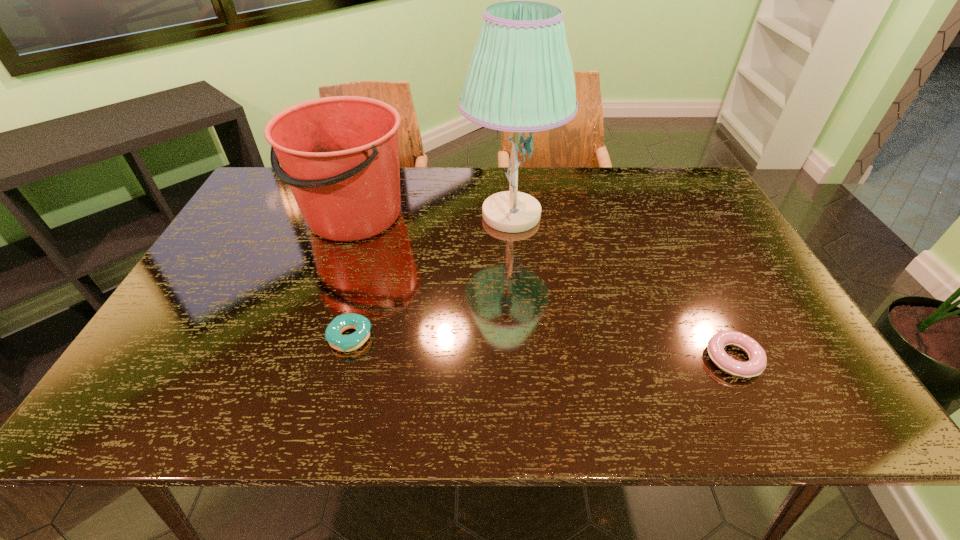
Locate an element on the screen. This screenshot has width=960, height=540. the second object from right to left is located at coordinates (520, 78).

The height and width of the screenshot is (540, 960). Find the location of `the tallest object`. the tallest object is located at coordinates (520, 78).

Where is `bucket`? bucket is located at coordinates (340, 155).

Locate an element on the screen. the left doughnut is located at coordinates (345, 343).

This screenshot has height=540, width=960. What are the coordinates of `the right doughnut` in the screenshot? It's located at (755, 366).

Find the location of a particular element. The height and width of the screenshot is (540, 960). free location located on the front of the tallest object is located at coordinates (519, 312).

You are a GUI agent. You are given a task and a screenshot of the screen. Output one action in this format:
    pyautogui.click(x=<x>, y=<y>)
    Task: Click on the free location located 0.400m on the right of the second tallest object
    
    Given the screenshot: What is the action you would take?
    pyautogui.click(x=543, y=215)

You are a GUI agent. You are given a task and a screenshot of the screen. Output one action in this format:
    pyautogui.click(x=<x>, y=<y>)
    Task: Click on the vacant space located on the back of the left doughnut
    Image resolution: width=960 pixels, height=540 pixels.
    Given the screenshot: What is the action you would take?
    pyautogui.click(x=373, y=251)

The height and width of the screenshot is (540, 960). Find the location of `vacant space located 0.100m on the right of the right doughnut`. vacant space located 0.100m on the right of the right doughnut is located at coordinates (805, 359).

Locate an element on the screen. The image size is (960, 540). lamp that is at the far edge is located at coordinates (520, 78).